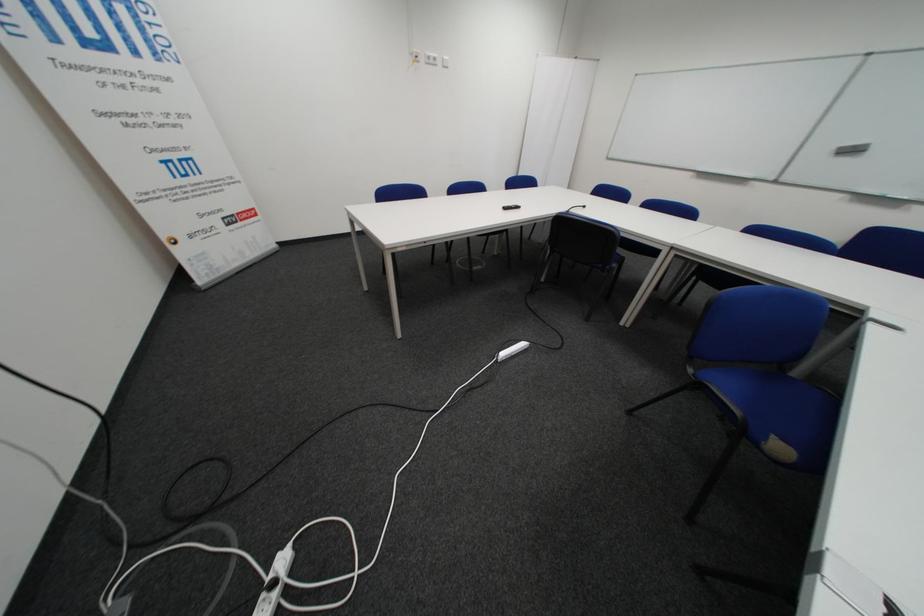
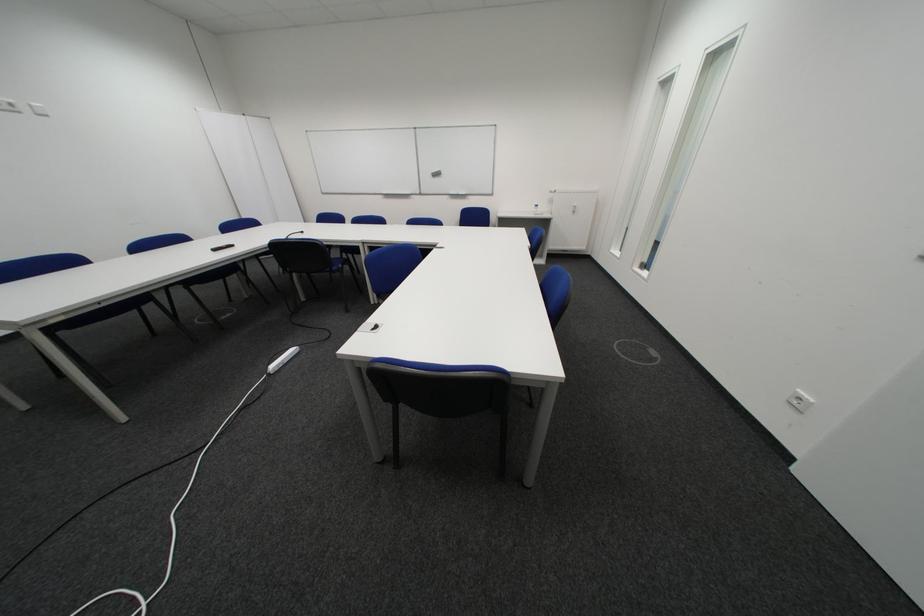
The point at (523, 206) is marked in the first image. Where is the corresponding point in the second image?

(233, 246)